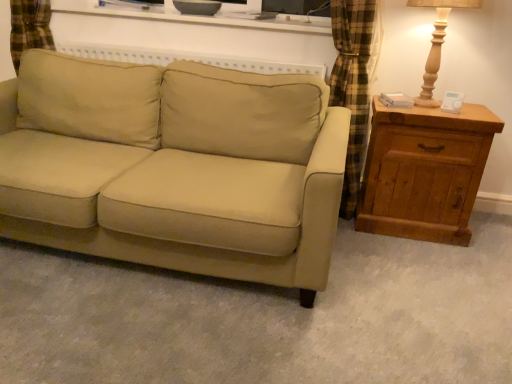
Where is `vacant area that lies between wooden chest of drawers at right and beige fabric couch at center`? The width and height of the screenshot is (512, 384). vacant area that lies between wooden chest of drawers at right and beige fabric couch at center is located at coordinates (385, 264).